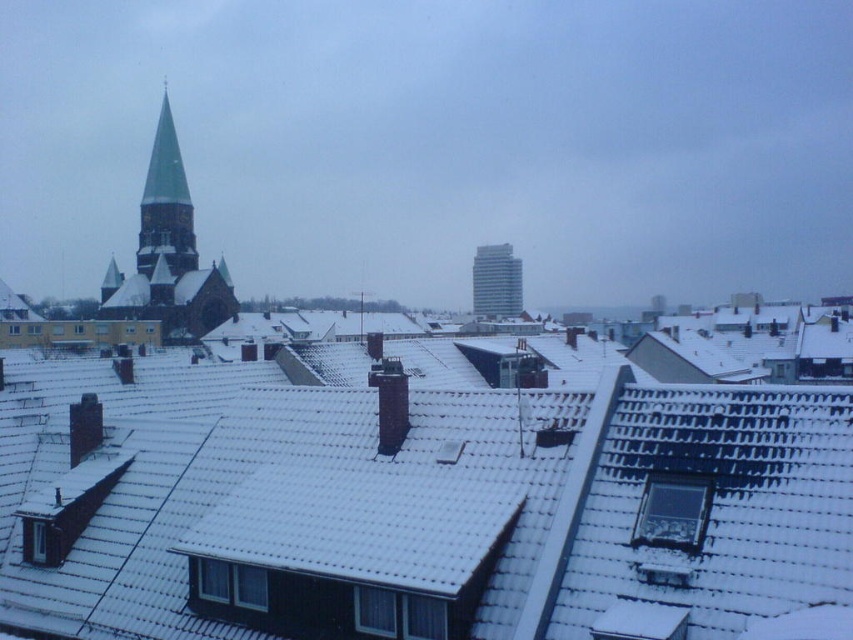
Question: Does green matte tower at upper left appear over green glass spire at upper left?

Choices:
 (A) yes
 (B) no

Answer: (B)

Question: Which point appears farthest from the camera in this image?

Choices:
 (A) (165, 166)
 (B) (509, 300)
 (C) (392, 401)
 (D) (189, 296)

Answer: (B)

Question: Estimate the real-world distances between objects in this image. Which object is closer to the green glass spire at upper left?

Choices:
 (A) white glassy tower at center
 (B) smooth gray chimney at center

Answer: (A)

Question: Can you confirm if green matte tower at upper left is positioned above white glassy tower at center?

Choices:
 (A) yes
 (B) no

Answer: (A)

Question: Which object appears farthest from the camera in this image?

Choices:
 (A) smooth gray chimney at center
 (B) green glass spire at upper left
 (C) green matte tower at upper left
 (D) white glassy tower at center

Answer: (D)

Question: Is green glass spire at upper left below white glassy tower at center?

Choices:
 (A) yes
 (B) no

Answer: (B)